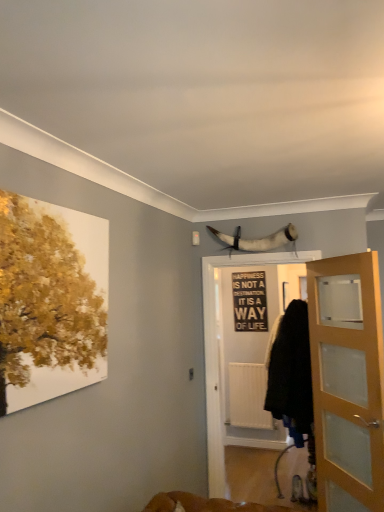
Question: Is black fabric screen door at center bigger than white matte radiator at center?

Choices:
 (A) no
 (B) yes

Answer: (B)

Question: Can you confirm if black fabric screen door at center is wider than white matte radiator at center?

Choices:
 (A) yes
 (B) no

Answer: (A)

Question: Is white matte radiator at center located within black fabric screen door at center?

Choices:
 (A) yes
 (B) no

Answer: (B)

Question: Does black fabric screen door at center turn towards white matte radiator at center?

Choices:
 (A) yes
 (B) no

Answer: (B)

Question: Is white matte radiator at center at the back of black fabric screen door at center?

Choices:
 (A) yes
 (B) no

Answer: (A)

Question: Relative to white horn at upper center, is black matte signboard at center in front or behind?

Choices:
 (A) behind
 (B) front

Answer: (A)

Question: Do you think black matte signboard at center is within white horn at upper center, or outside of it?

Choices:
 (A) outside
 (B) inside

Answer: (A)

Question: From a real-world perspective, is black matte signboard at center positioned above or below white horn at upper center?

Choices:
 (A) below
 (B) above

Answer: (A)

Question: From the image's perspective, relative to white horn at upper center, is black matte signboard at center above or below?

Choices:
 (A) below
 (B) above

Answer: (A)

Question: From the image's perspective, is white matte radiator at center above or below black matte signboard at center?

Choices:
 (A) above
 (B) below

Answer: (B)

Question: Do you think white matte radiator at center is within black matte signboard at center, or outside of it?

Choices:
 (A) outside
 (B) inside

Answer: (A)

Question: Is white matte radiator at center bigger or smaller than black matte signboard at center?

Choices:
 (A) big
 (B) small

Answer: (A)

Question: Is point (271, 417) closer or farther from the camera than point (258, 305)?

Choices:
 (A) closer
 (B) farther

Answer: (B)

Question: Does point (244, 393) appear closer or farther from the camera than point (215, 366)?

Choices:
 (A) farther
 (B) closer

Answer: (A)

Question: Do you think white matte radiator at center is within black fabric screen door at center, or outside of it?

Choices:
 (A) inside
 (B) outside

Answer: (B)